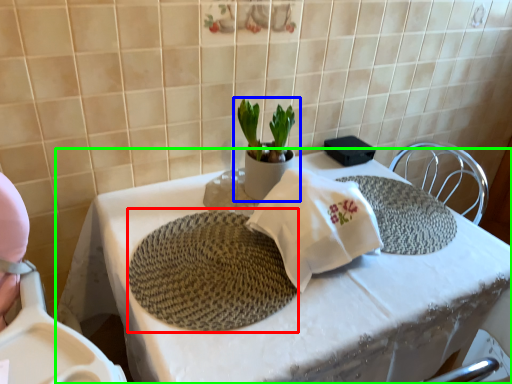
Question: Based on their relative distances, which object is nearer to mat (highlighted by a red box)? Choose from houseplant (highlighted by a blue box) and table (highlighted by a green box).

Choices:
 (A) houseplant
 (B) table

Answer: (B)